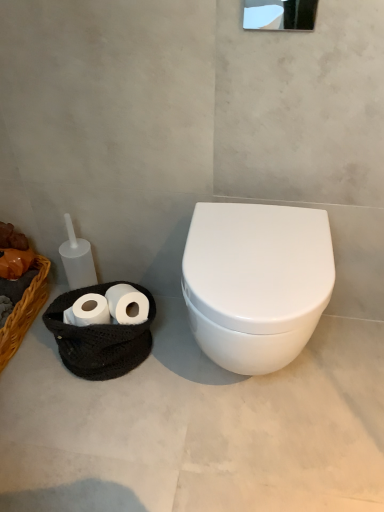
Question: From a real-world perspective, is white matte toilet paper at lower left under white glossy toilet at right?

Choices:
 (A) no
 (B) yes

Answer: (A)

Question: Does white matte toilet paper at lower left appear on the left side of white glossy toilet at right?

Choices:
 (A) yes
 (B) no

Answer: (A)

Question: Considering the relative sizes of white matte toilet paper at lower left and white glossy toilet at right in the image provided, is white matte toilet paper at lower left shorter than white glossy toilet at right?

Choices:
 (A) yes
 (B) no

Answer: (B)

Question: Is white matte toilet paper at lower left to the right of white glossy toilet at right from the viewer's perspective?

Choices:
 (A) yes
 (B) no

Answer: (B)

Question: Can you confirm if white matte toilet paper at lower left is wider than white glossy toilet at right?

Choices:
 (A) yes
 (B) no

Answer: (B)

Question: Is white matte toilet paper at lower left turned away from white glossy toilet at right?

Choices:
 (A) yes
 (B) no

Answer: (B)

Question: Could you tell me if white glossy toilet at center is turned towards braided wicker basket at left?

Choices:
 (A) no
 (B) yes

Answer: (A)

Question: Is white glossy toilet at center turned away from braided wicker basket at left?

Choices:
 (A) no
 (B) yes

Answer: (A)

Question: Does white glossy toilet at center lie in front of braided wicker basket at left?

Choices:
 (A) yes
 (B) no

Answer: (A)

Question: Does white glossy toilet at center appear on the right side of braided wicker basket at left?

Choices:
 (A) yes
 (B) no

Answer: (A)

Question: Can you confirm if white glossy toilet at center is taller than braided wicker basket at left?

Choices:
 (A) no
 (B) yes

Answer: (B)

Question: Considering the relative sizes of white glossy toilet at center and braided wicker basket at left in the image provided, is white glossy toilet at center shorter than braided wicker basket at left?

Choices:
 (A) yes
 (B) no

Answer: (B)

Question: Is white glossy mirror at upper center in contact with braided wicker basket at left?

Choices:
 (A) yes
 (B) no

Answer: (B)